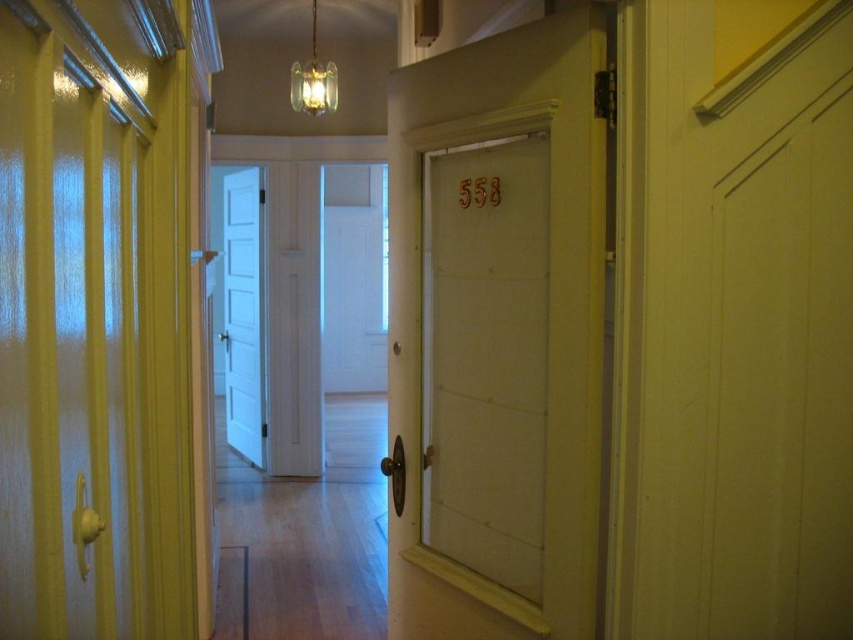
Question: Is white wooden door at center wider than white painted wood door at center?

Choices:
 (A) no
 (B) yes

Answer: (A)

Question: Among these points, which one is nearest to the camera?

Choices:
 (A) (234, 282)
 (B) (473, 454)

Answer: (B)

Question: Which point appears farthest from the camera in this image?

Choices:
 (A) (438, 516)
 (B) (227, 408)

Answer: (B)

Question: Where is white wooden door at center located in relation to white painted wood door at center in the image?

Choices:
 (A) above
 (B) below

Answer: (B)

Question: Can you confirm if white wooden door at center is positioned above white painted wood door at center?

Choices:
 (A) no
 (B) yes

Answer: (A)